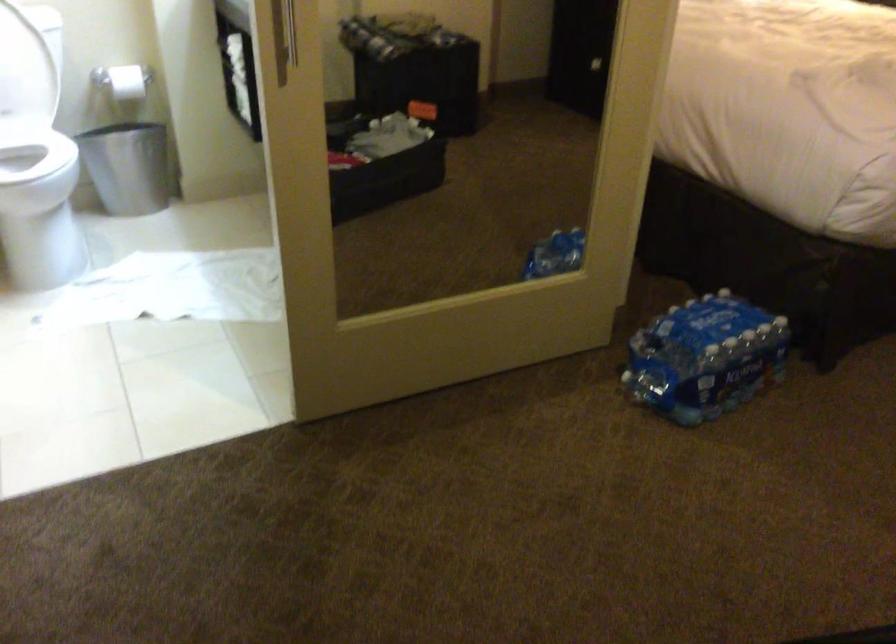
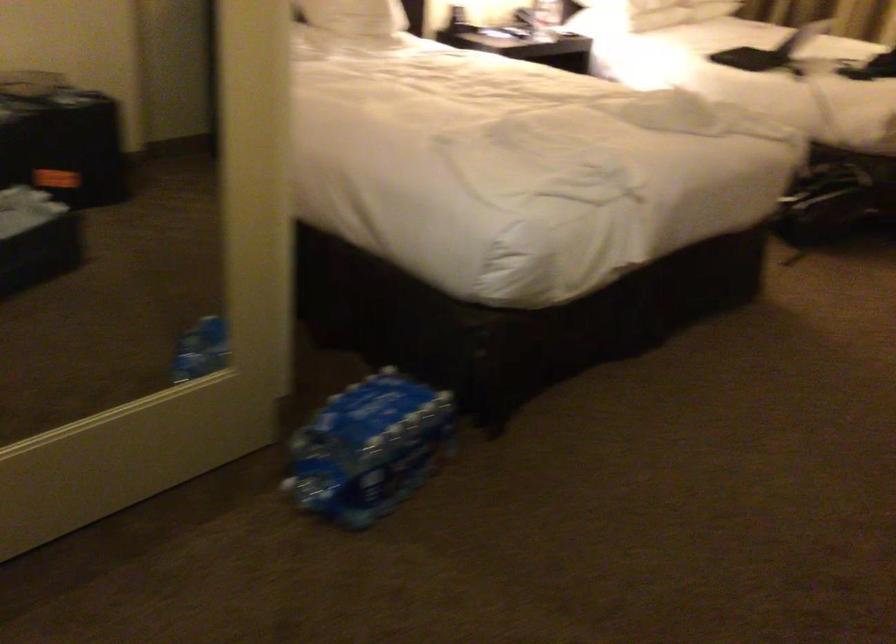
Looking at this image, which direction would the cameraman need to move to produce the second image?

The cameraman walked toward right, forward.